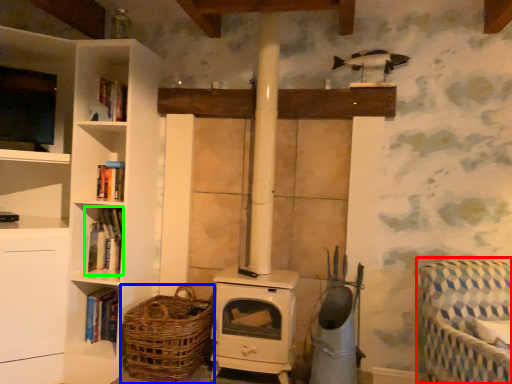
Question: Estimate the real-world distances between objects in this image. Which object is closer to rocking chair (highlighted by a red box), basket (highlighted by a blue box) or book (highlighted by a green box)?

Choices:
 (A) basket
 (B) book

Answer: (A)